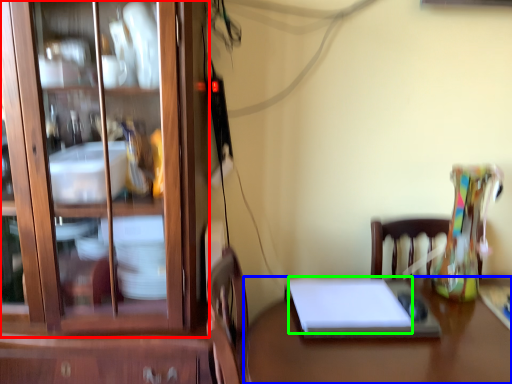
Question: Based on their relative distances, which object is nearer to cabinetry (highlighted by a red box)? Choose from desk (highlighted by a blue box) and notebook (highlighted by a green box).

Choices:
 (A) desk
 (B) notebook

Answer: (B)